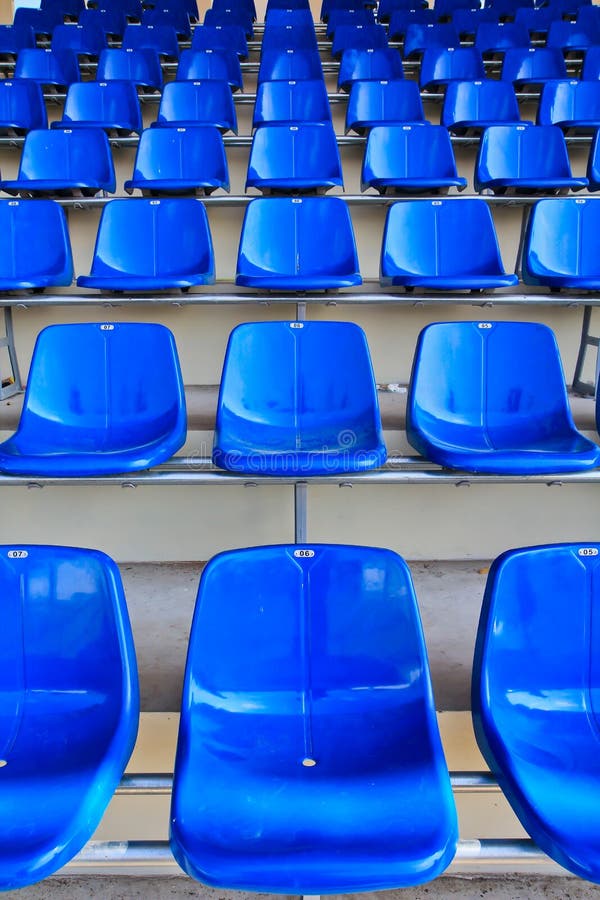
Where is `seat supports`? seat supports is located at coordinates (144, 850), (153, 777), (179, 473), (180, 457), (221, 294), (225, 196), (238, 135), (243, 95), (246, 66), (255, 41).